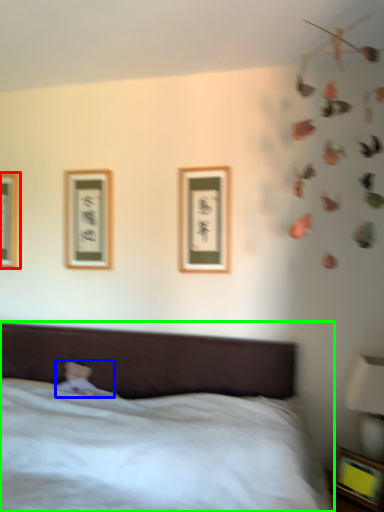
Question: Which object is the farthest from picture frame (highlighted by a red box)? Choose among these: toy (highlighted by a blue box) or bed (highlighted by a green box).

Choices:
 (A) toy
 (B) bed

Answer: (B)